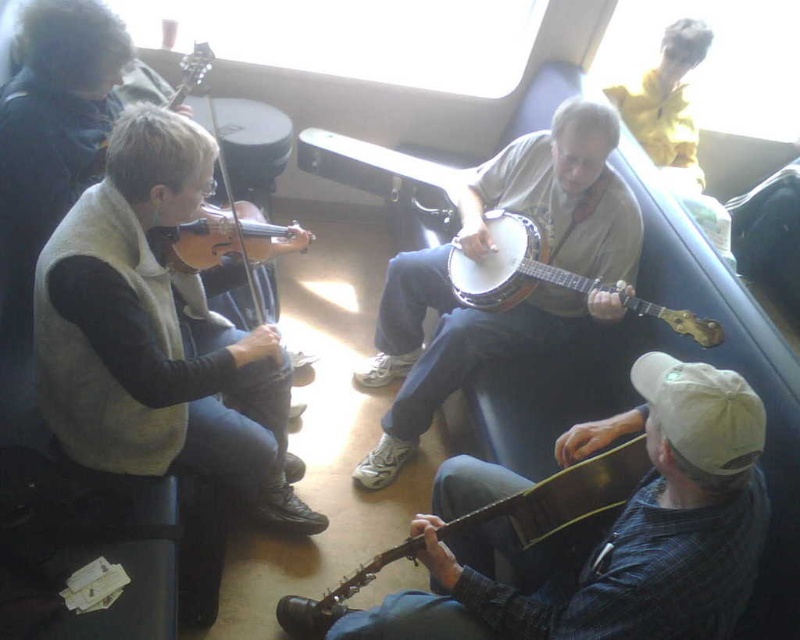
From the picture: You are sitting in the vehicle and want to reach both the violinist and the banjo player. Which of the two points, point (442, 305) or point (288, 228), is closer to you?

Point (442, 305) is further to the viewer than point (288, 228), so point (288, 228) is closer to you.

You are a photographer trying to capture a photo of the white wooden banjo at center and the wooden banjo at lower right. Which one should you focus on if you want to photograph the taller instrument?

The wooden banjo at lower right is taller than the white wooden banjo at center, so you should focus on the wooden banjo at lower right to capture the taller instrument.